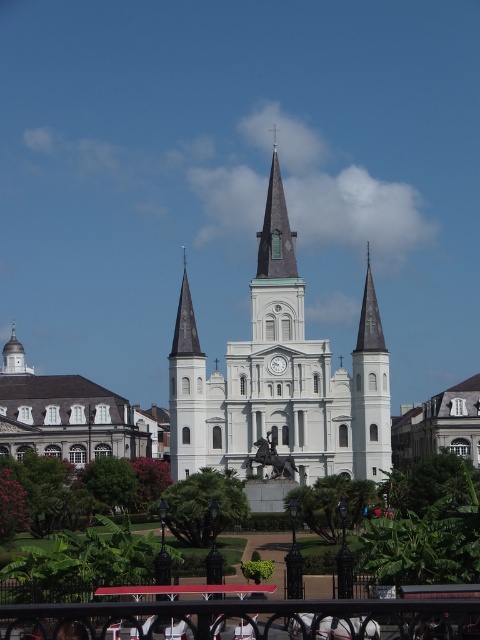
The height and width of the screenshot is (640, 480). Describe the element at coordinates (62, 413) in the screenshot. I see `white stone church at center` at that location.

Is white stone church at center taller than white glossy clock at center?

Correct, white stone church at center is much taller as white glossy clock at center.

This screenshot has height=640, width=480. Identify the location of white stone church at center. (62, 413).

Can you confirm if white stone clock tower at center is wider than dark gray stone spire at center?

Yes, white stone clock tower at center is wider than dark gray stone spire at center.

Is white stone clock tower at center to the left of dark gray stone spire at center from the viewer's perspective?

Yes, white stone clock tower at center is to the left of dark gray stone spire at center.

Is point (322, 420) farther from camera compared to point (268, 192)?

No, (322, 420) is closer to viewer.

This screenshot has height=640, width=480. Find the location of `white stone clock tower at center`. white stone clock tower at center is located at coordinates (279, 378).

Can you confirm if white stone clock tower at center is wider than white stone church at center?

Indeed, white stone clock tower at center has a greater width compared to white stone church at center.

Identify the location of white stone clock tower at center. (279, 378).